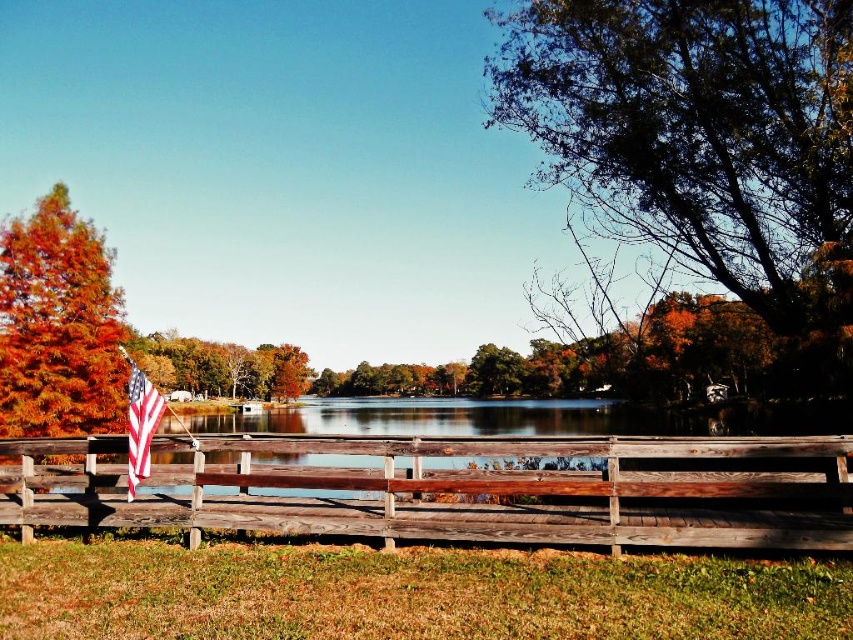
Can you confirm if orange autumn leaves at left is taller than green leafy tree at center?

Indeed, orange autumn leaves at left has a greater height compared to green leafy tree at center.

Who is higher up, orange autumn leaves at left or green leafy tree at center?

green leafy tree at center

Between point (283, 346) and point (490, 353), which one is positioned behind?

Positioned behind is point (283, 346).

Identify the location of orange autumn leaves at left. (223, 365).

Is american flag at left taller than green leafy tree at center?

Yes, american flag at left is taller than green leafy tree at center.

Who is positioned more to the right, american flag at left or green leafy tree at center?

From the viewer's perspective, green leafy tree at center appears more on the right side.

Where is `american flag at left`? The width and height of the screenshot is (853, 640). american flag at left is located at coordinates (140, 422).

Is point (184, 461) positioned behind point (218, 365)?

That is False.

Which is more to the right, wooden fence at center or orange autumn leaves at left?

From the viewer's perspective, wooden fence at center appears more on the right side.

Is point (670, 442) farther from viewer compared to point (259, 349)?

No, it is in front of (259, 349).

At what (x,y) coordinates should I click in order to perform the action: click on wooden fence at center. Please return your answer as a coordinate pair (x, y). Looking at the image, I should click on (457, 488).